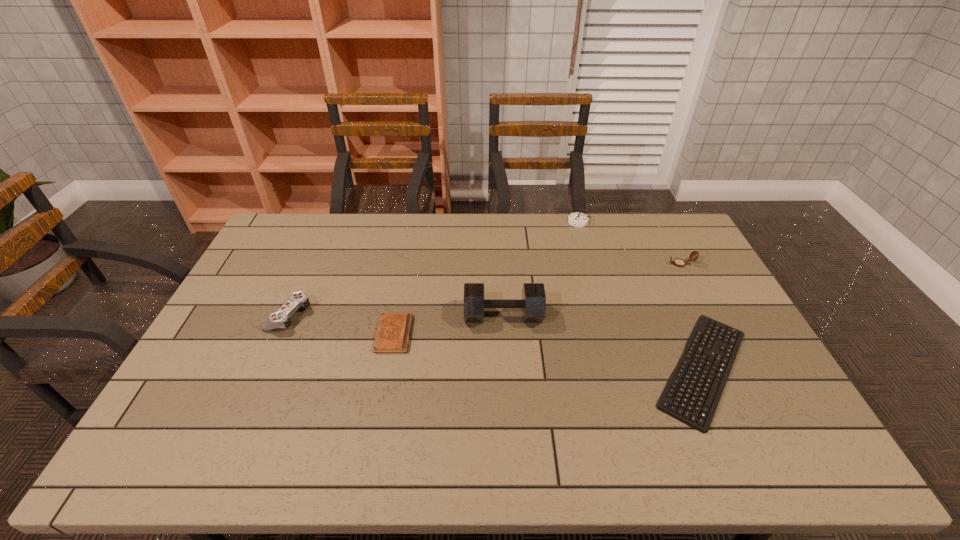
The height and width of the screenshot is (540, 960). Identify the location of vacant space that satisfies the following two spatial constraints: 1. on the back side of the left compass; 2. on the left side of the control. (330, 222).

Identify the location of vacant region that satisfies the following two spatial constraints: 1. on the face of the nearer compass; 2. on the front side of the computer keyboard. This screenshot has height=540, width=960. (735, 368).